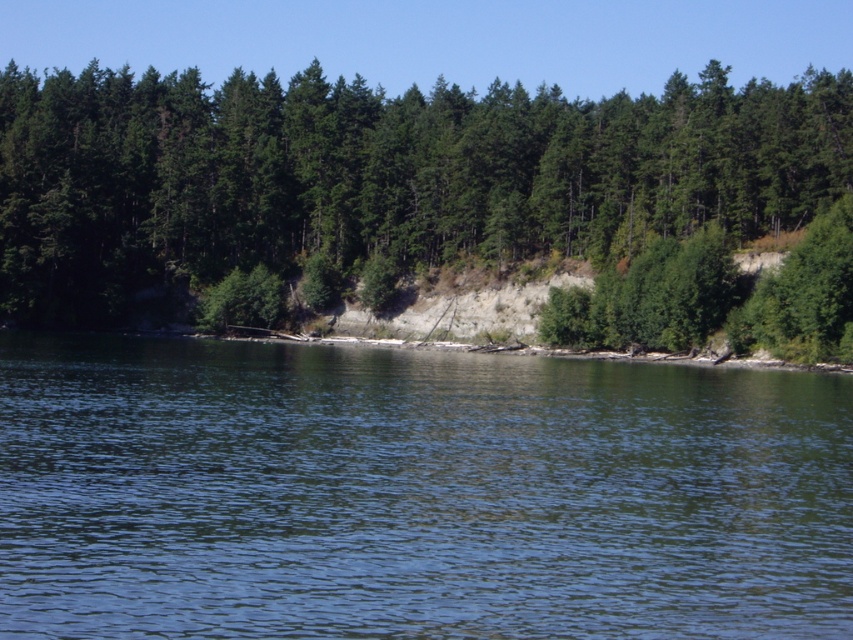
Question: Which object is closer to the camera taking this photo?

Choices:
 (A) green matte trees at upper center
 (B) clear water at center

Answer: (B)

Question: Considering the relative positions of clear water at center and green matte trees at upper center in the image provided, where is clear water at center located with respect to green matte trees at upper center?

Choices:
 (A) below
 (B) above

Answer: (A)

Question: Among these objects, which one is farthest from the camera?

Choices:
 (A) clear water at center
 (B) green matte trees at upper center

Answer: (B)

Question: Can you confirm if clear water at center is positioned to the right of green matte trees at upper center?

Choices:
 (A) yes
 (B) no

Answer: (B)

Question: From the image, what is the correct spatial relationship of clear water at center in relation to green matte trees at upper center?

Choices:
 (A) above
 (B) below

Answer: (B)